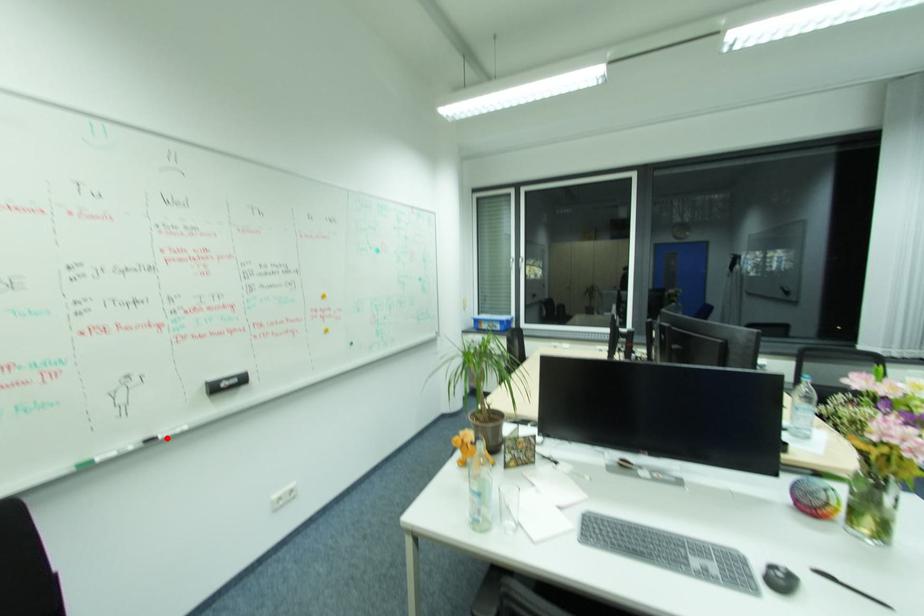
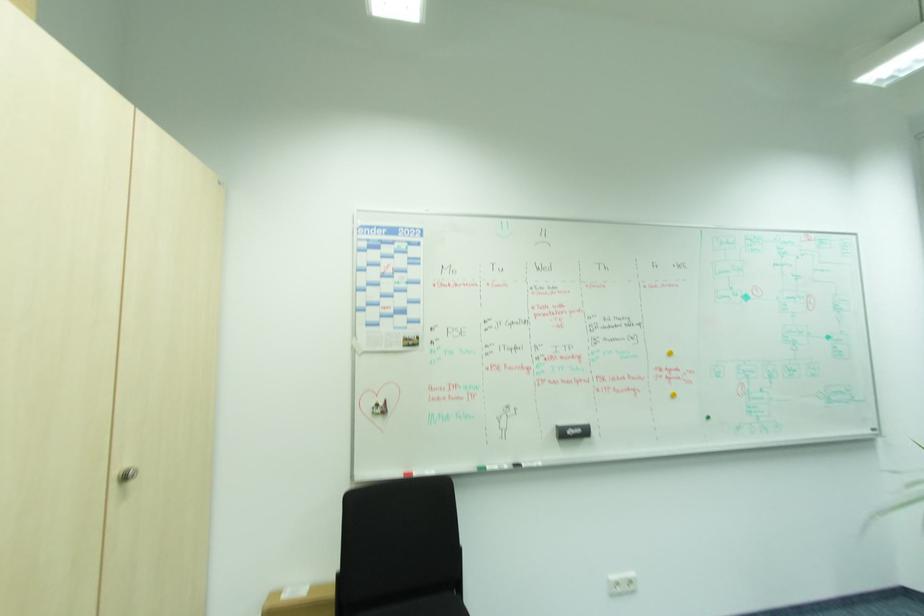
Locate, in the second image, the point that corresponds to the highlighted location in the first image.

(528, 464)